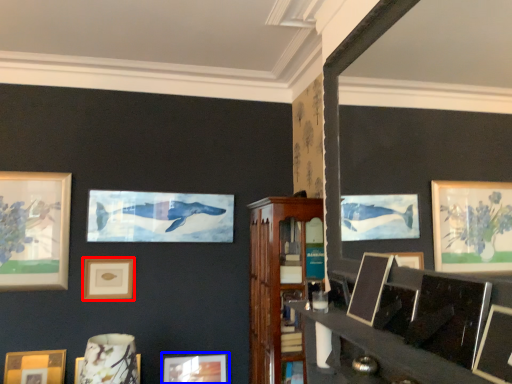
Question: Which object is closer to the camera taking this photo, picture frame (highlighted by a red box) or picture frame (highlighted by a blue box)?

Choices:
 (A) picture frame
 (B) picture frame

Answer: (B)